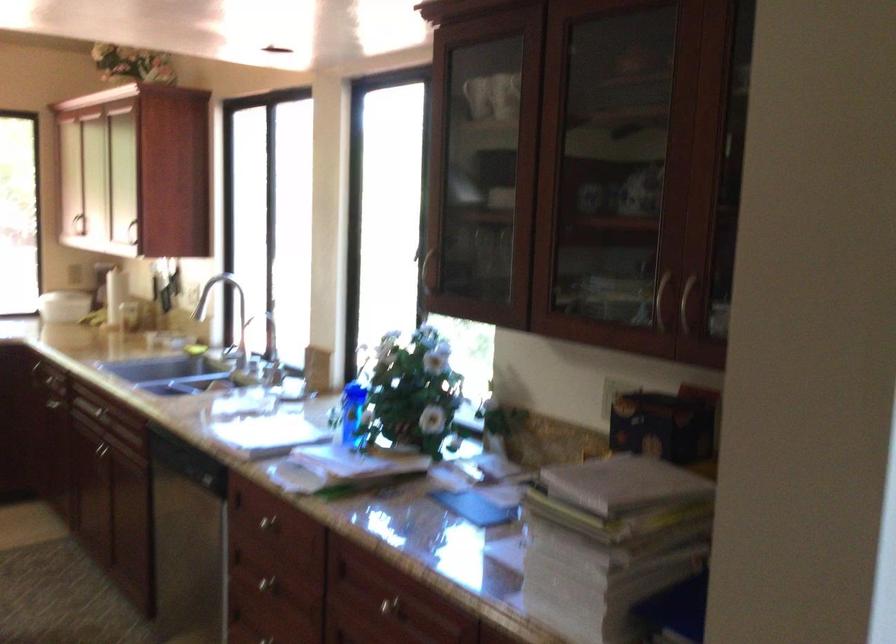
In order to click on white light switch in this screenshot , I will do `click(614, 393)`.